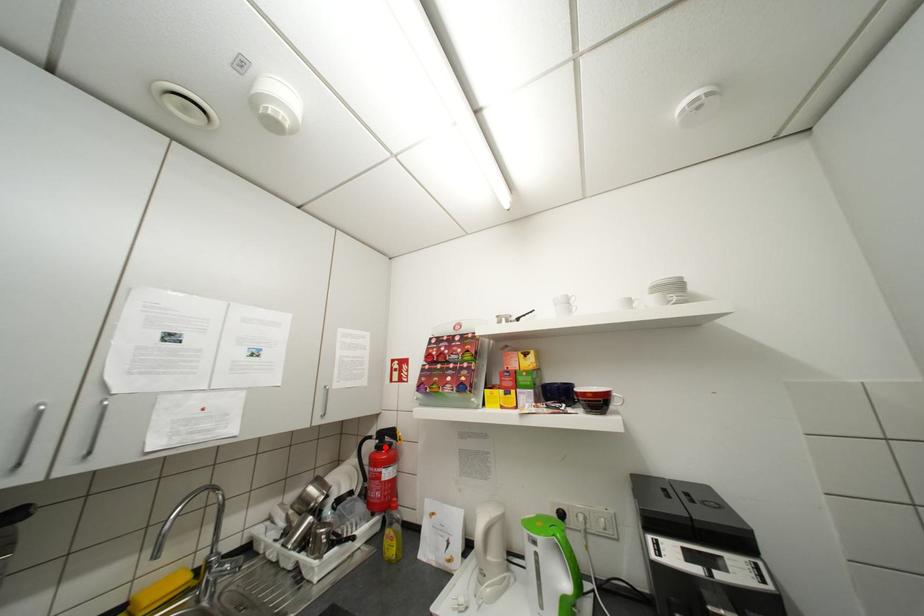
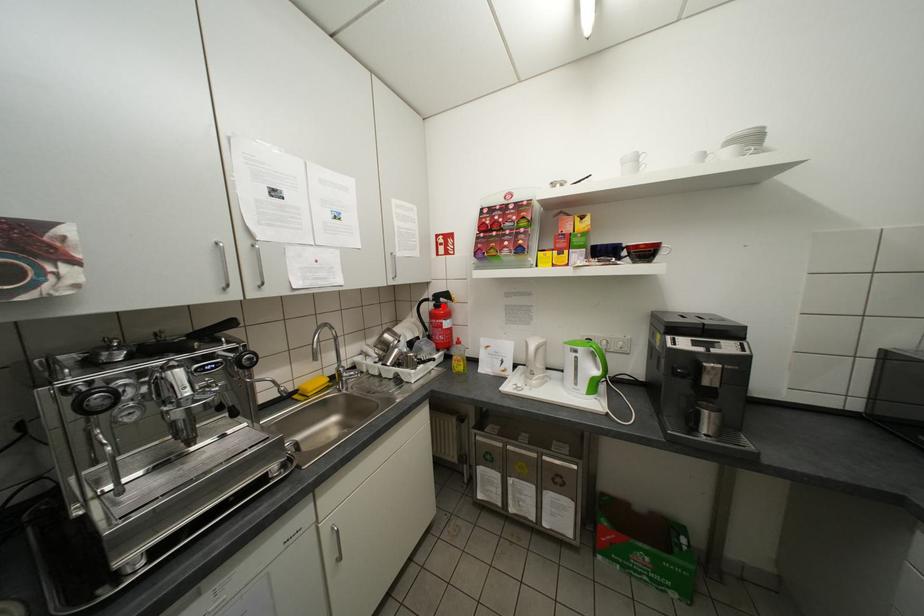
I am providing you with two images of the same scene from different viewpoints. A red point is marked on the first image and another point is marked on the second image. Do the highlighted points in image1 and image2 indicate the same real-world spot?

Yes